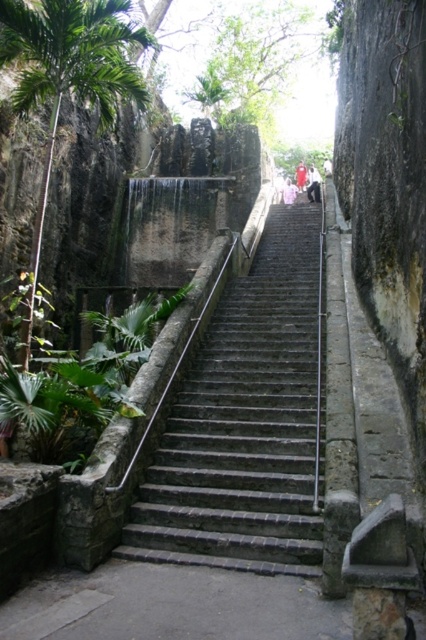
Consider the image. You are standing at the bottom of the gray stone stairs at center. Which direction should you move to reach the point marked at coordinate [244,422]?

The gray stone stairs at center is already located at point [244,422], so you are already at the correct location.

You are planning to hang a 120 feet long banner from the pink fabric at upper center down to the gray stone stairs at center. Will the banner be long enough to reach the stairs?

The distance between the gray stone stairs at center and the pink fabric at upper center is 119.73 feet. Since the banner is 120 feet long, it will be long enough to reach the stairs.

You are a delivery person carrying a large package and need to climb the gray stone stairs at center. The package is 30 feet long. Can you safely carry it up the stairs?

The gray stone stairs at center are 29.35 feet apart, so the package is longer than the distance between the stairs. This may make it difficult to maneuver the package safely up the stairs.